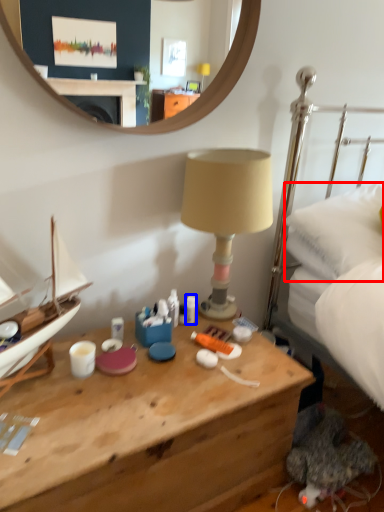
Question: Which object is further to the camera taking this photo, pillow (highlighted by a red box) or toiletry (highlighted by a blue box)?

Choices:
 (A) pillow
 (B) toiletry

Answer: (B)